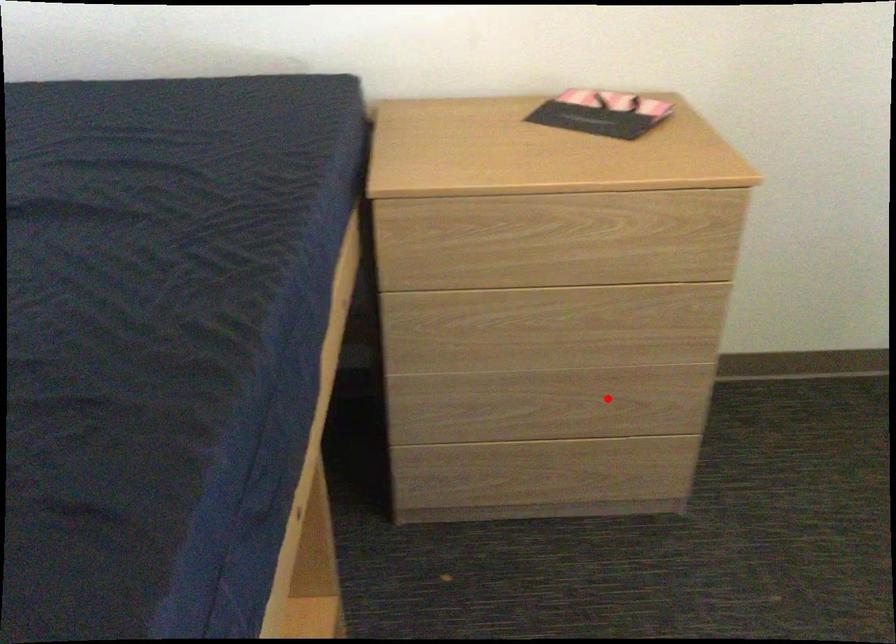
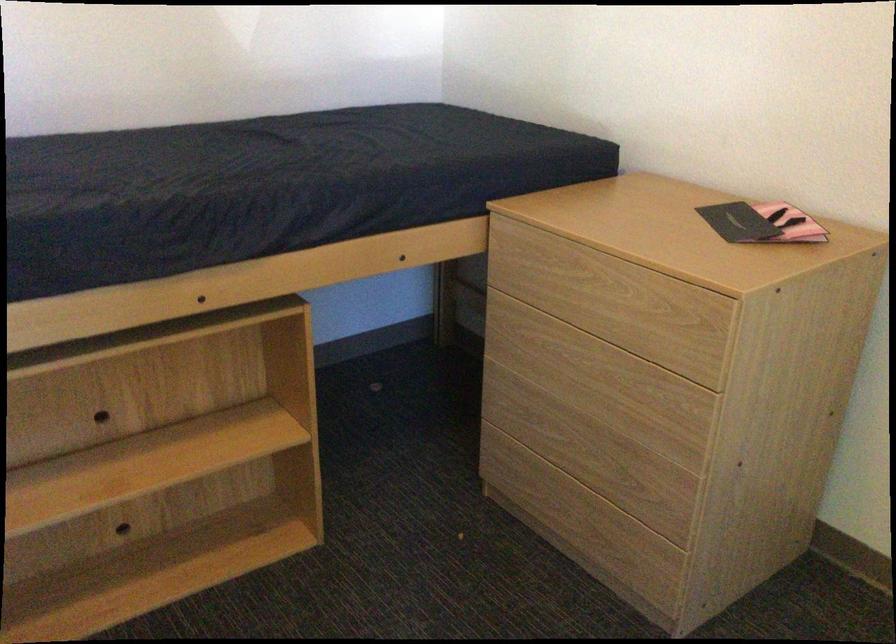
Question: I am providing you with two images of the same scene from different viewpoints. A red point is marked on the first image. At the location where the point appears in image 1, is it still visible in image 2?

Choices:
 (A) Yes
 (B) No

Answer: (A)